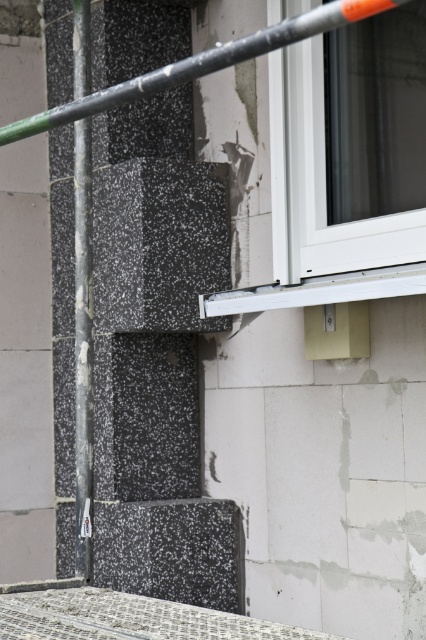
Is point (281, 250) farther from camera compared to point (83, 468)?

No, (281, 250) is closer to viewer.

From the picture: Does white plastic window at upper right come behind black textured pole at left?

No, it is in front of black textured pole at left.

Which is behind, point (345, 67) or point (89, 74)?

The point (89, 74) is behind.

You are a GUI agent. You are given a task and a screenshot of the screen. Output one action in this format:
    pyautogui.click(x=<x>, y=<y>)
    Task: Click on the white plastic window at upper right
    Image resolution: width=426 pixels, height=640 pixels.
    Given the screenshot: What is the action you would take?
    pyautogui.click(x=350, y=147)

Between white plastic window at upper right and metallic gray pole at upper center, which one appears on the left side from the viewer's perspective?

metallic gray pole at upper center is more to the left.

Is white plastic window at upper right thinner than metallic gray pole at upper center?

Yes, white plastic window at upper right is thinner than metallic gray pole at upper center.

Which is behind, point (383, 16) or point (32, 120)?

Point (383, 16)

This screenshot has width=426, height=640. I want to click on white plastic window at upper right, so click(350, 147).

Between black textured pole at left and metallic gray pole at upper center, which one is positioned lower?

black textured pole at left is lower down.

Is black textured pole at left taller than metallic gray pole at upper center?

Correct, black textured pole at left is much taller as metallic gray pole at upper center.

Describe the element at coordinates (83, 348) in the screenshot. Image resolution: width=426 pixels, height=640 pixels. I see `black textured pole at left` at that location.

I want to click on black textured pole at left, so click(83, 348).